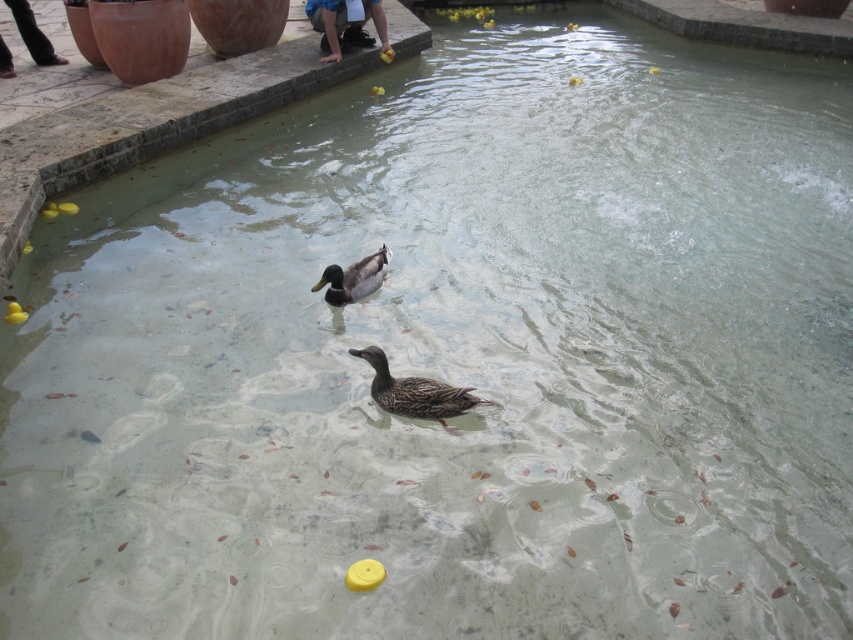
You are a maintenance worker who needs to clean the pool. You have a long pole that can reach 1 meter. If you are standing at the edge of the pool, can you reach both the brown matte duck at center and the shiny brown duck at center with the pole?

The brown matte duck at center and shiny brown duck at center are 1.12 meters apart from each other. Since the pole can only reach 1 meter, you cannot reach both ducks with a single pole. You would need to move closer to each duck individually or use a longer tool.

You are standing at the edge of the pool and want to reach both points in the water. Which point, point (392, 394) or point (380, 280), will you reach first if you walk straight towards them?

Point (392, 394) is closer to the camera than point (380, 280), so you will reach point (392, 394) first.

You are standing at the edge of the pool and want to throw a pebble to hit the brown matte duck at center. Based on the reflection on the water, where should you aim relative to its reflection?

You should aim directly at the reflection of the brown matte duck at center because the reflection in water typically mirrors the actual object. Since the reflection is at the same 2D location as the duck itself, aiming at the reflection will hit the duck.